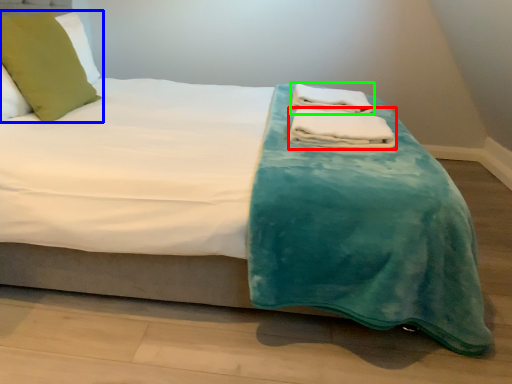
Question: Which object is the closest to the bath towel (highlighted by a red box)? Choose among these: pillow (highlighted by a blue box) or bath towel (highlighted by a green box).

Choices:
 (A) pillow
 (B) bath towel

Answer: (B)